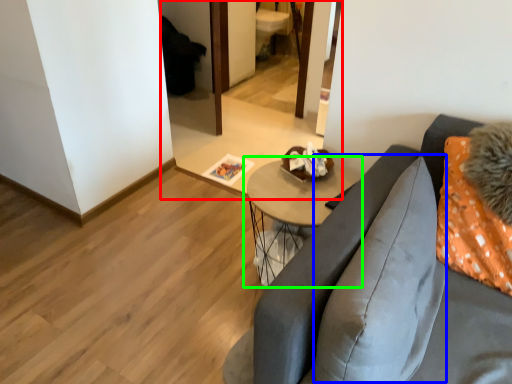
Question: Considering the real-world distances, which object is farthest from mirror (highlighted by a red box)? pillow (highlighted by a blue box) or table (highlighted by a green box)?

Choices:
 (A) pillow
 (B) table

Answer: (A)